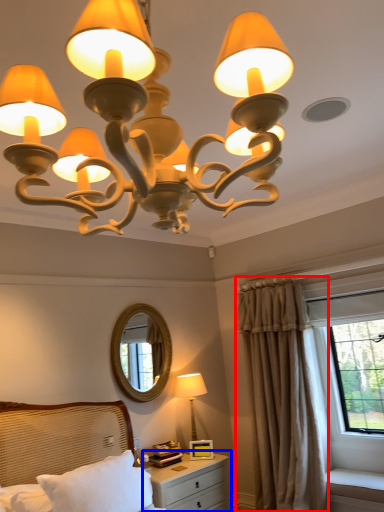
Question: Which point is closer to the camera, curtain (highlighted by a red box) or nightstand (highlighted by a blue box)?

Choices:
 (A) curtain
 (B) nightstand

Answer: (B)